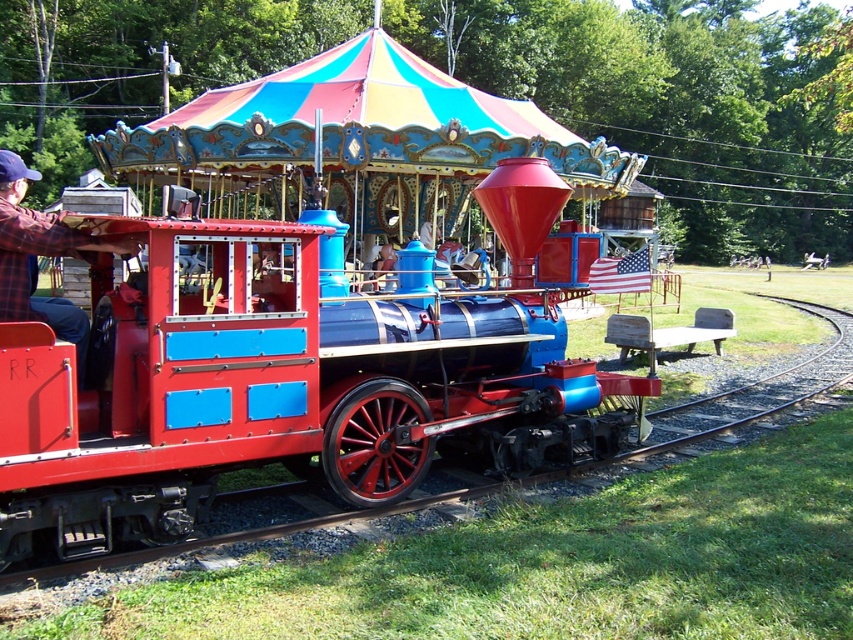
You are a passenger on the shiny red locomotive at center and want to wave at someone wearing the plaid flannel shirt at left. Since the plaid flanel shirt at left is closer to you, should you stand up to be seen better?

The shiny red locomotive at center is smaller than the plaid flannel shirt at left, so you should stand up to be seen better.

You are standing in front of the train engine and want to place a small flag at two specific points on the scene. The first point is at coordinates point (315, 419) and the second is at point (24, 320). Which point is closer to you?

Point (315, 419) is further to the viewer than point (24, 320). Therefore, point (24, 320) is closer to you.